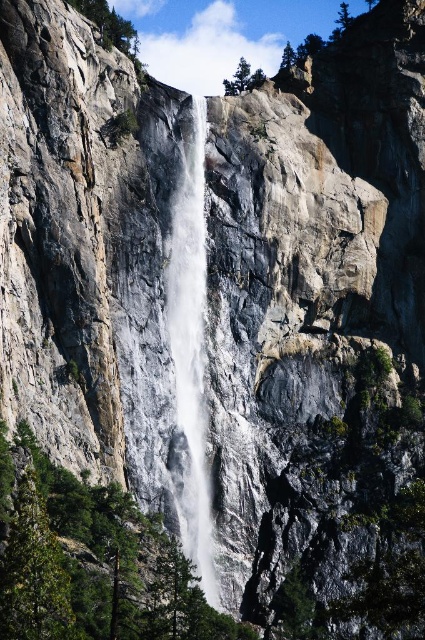
You are a hiker who wants to take a photo of the waterfall. You have a camera that can capture a maximum width of 10 meters. The green leafy tree at lower left and the green leafy tree at upper right are in your shot. Which tree will you need to adjust your camera angle to exclude if the combined width of both trees exceeds the camera limit?

The green leafy tree at lower left is wider than the green leafy tree at upper right. If their combined width exceeds the camera limit, you should adjust your camera angle to exclude the green leafy tree at lower left first since it is wider.

You are standing at the base of the waterfall and want to take a photo that includes both the green leafy tree at lower left and the green leafy tree at upper right. Which tree should you position closer to the center of your camera frame to ensure both are visible?

You should position the green leafy tree at upper right closer to the center of your camera frame because it is larger than the green leafy tree at lower left, making it more prominent and easier to include both in the photo.

You are standing at the base of the waterfall and want to reach the point marked as point (135, 40). Given that the average walking distance for a person is about 300 feet per minute, how many minutes will it take you to reach that point?

The distance between you and point (135, 40) is 375.71 feet. At an average walking pace of 300 feet per minute, it would take approximately 1.25 minutes to reach the point.